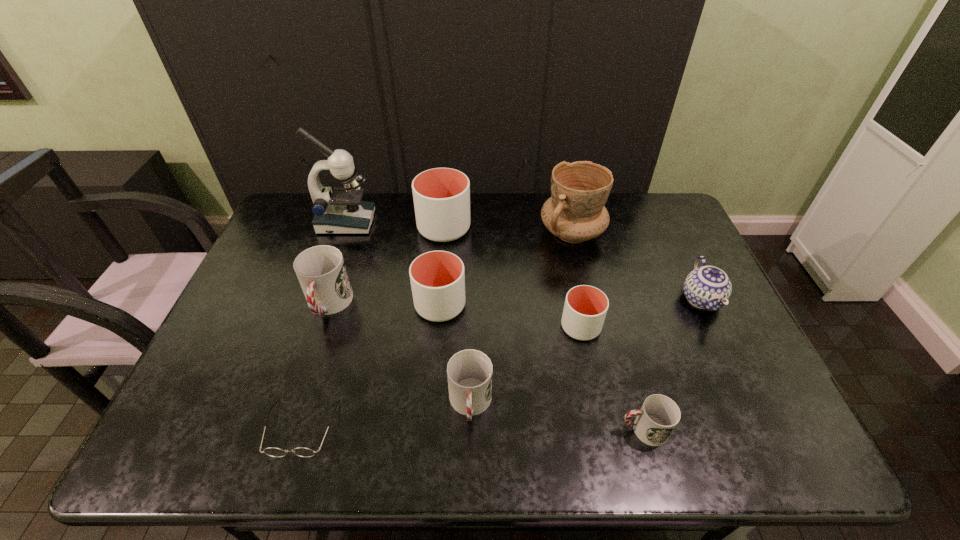
Locate an element on the screen. The width and height of the screenshot is (960, 540). microscope is located at coordinates (340, 211).

The width and height of the screenshot is (960, 540). In order to click on the second tallest object in this screenshot , I will do `click(575, 212)`.

What are the coordinates of `beige pottery` in the screenshot? It's located at (575, 212).

The height and width of the screenshot is (540, 960). I want to click on the farthest white cup, so click(441, 196).

At what (x,y) coordinates should I click in order to perform the action: click on the farthest cup. Please return your answer as a coordinate pair (x, y). Looking at the image, I should click on (441, 196).

The image size is (960, 540). What are the coordinates of `the leftmost red cup` in the screenshot? It's located at (321, 271).

Where is `the farthest red cup`? the farthest red cup is located at coordinates (321, 271).

Locate an element on the screen. the second biggest white cup is located at coordinates (437, 278).

Where is `chinaware`? chinaware is located at coordinates (707, 287).

Where is `the rightmost object`? the rightmost object is located at coordinates (707, 287).